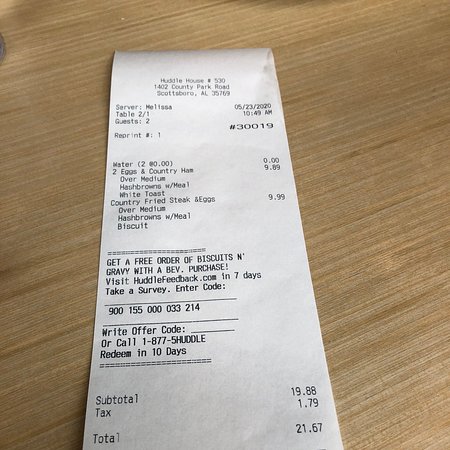
You are a GUI agent. You are given a task and a screenshot of the screen. Output one action in this format:
    pyautogui.click(x=<x>, y=<y>)
    Task: Click on the bottom edge of table
    The width and height of the screenshot is (450, 450).
    Given the screenshot: What is the action you would take?
    pyautogui.click(x=72, y=444), pyautogui.click(x=408, y=446)